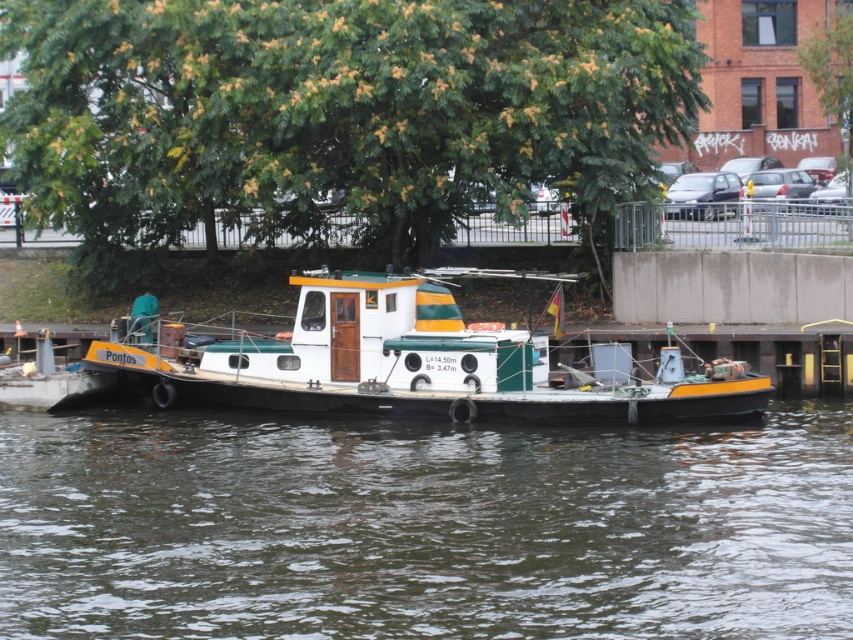
Question: Observing the image, what is the correct spatial positioning of transparent water at center in reference to green leafy tree at upper center?

Choices:
 (A) left
 (B) right

Answer: (B)

Question: Which point appears farthest from the camera in this image?

Choices:
 (A) (601, 100)
 (B) (722, 563)

Answer: (A)

Question: Does green leafy tree at upper center appear over white matte boat at center?

Choices:
 (A) yes
 (B) no

Answer: (A)

Question: Where is transparent water at center located in relation to white matte boat at center in the image?

Choices:
 (A) right
 (B) left

Answer: (A)

Question: Which point is farther to the camera?

Choices:
 (A) transparent water at center
 (B) white matte boat at center

Answer: (B)

Question: Which object is positioned closest to the green leafy tree at upper center?

Choices:
 (A) white matte boat at center
 (B) transparent water at center

Answer: (A)